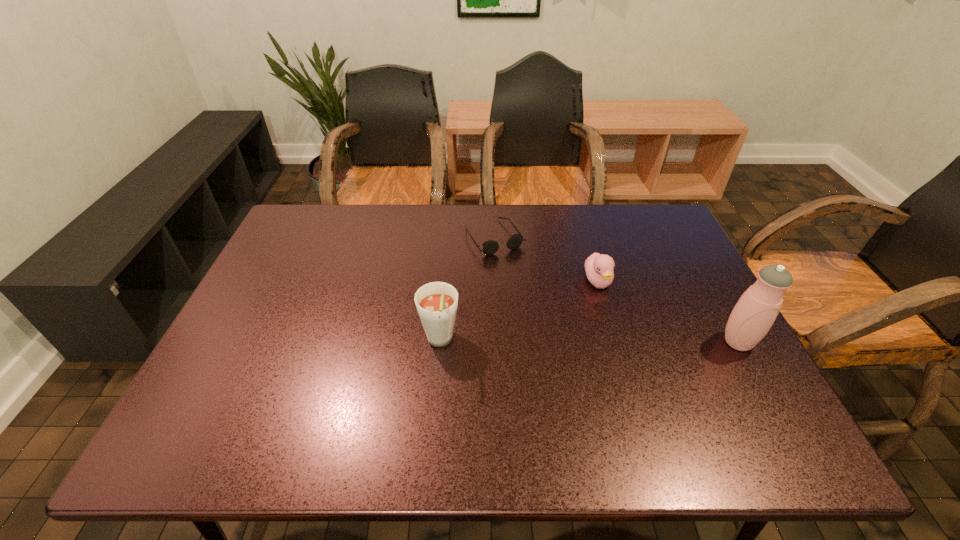
Find the location of a particular element. The height and width of the screenshot is (540, 960). vacant point located between the second farthest object and the farthest object is located at coordinates (546, 260).

Find the location of a particular element. This screenshot has height=540, width=960. free area in between the root beer and the rightmost object is located at coordinates (588, 342).

Where is `object that ranks as the closest to the farthest object`? The height and width of the screenshot is (540, 960). object that ranks as the closest to the farthest object is located at coordinates (599, 268).

Select which object appears as the third closest to the third object from left to right. Please provide its 2D coordinates. Your answer should be formatted as a tuple, i.e. [(x, y)], where the tuple contains the x and y coordinates of a point satisfying the conditions above.

[(436, 302)]

The width and height of the screenshot is (960, 540). I want to click on vacant point that satisfies the following two spatial constraints: 1. on the front side of the second farthest object; 2. on the left side of the sunglasses, so click(x=496, y=282).

The width and height of the screenshot is (960, 540). Find the location of `vacant space that satisfies the following two spatial constraints: 1. on the front side of the thermos bottle; 2. on the left side of the third object from right to left`. vacant space that satisfies the following two spatial constraints: 1. on the front side of the thermos bottle; 2. on the left side of the third object from right to left is located at coordinates (499, 342).